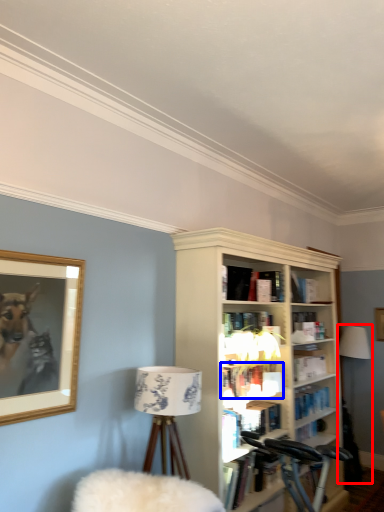
Question: Which point is closer to the camera, table lamp (highlighted by a red box) or book (highlighted by a blue box)?

Choices:
 (A) table lamp
 (B) book

Answer: (B)